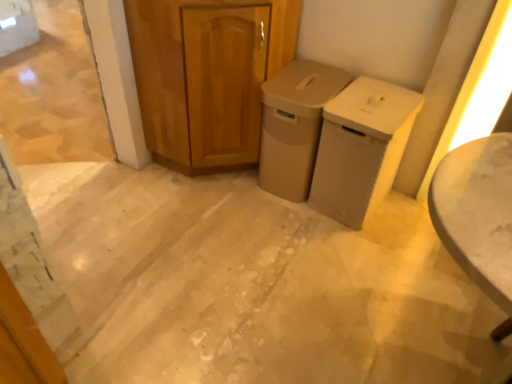
Identify the location of blank space situated above beige matte trash can at center, positioned as the 2th waste container in right-to-left order (from a real-world perspective). (305, 80).